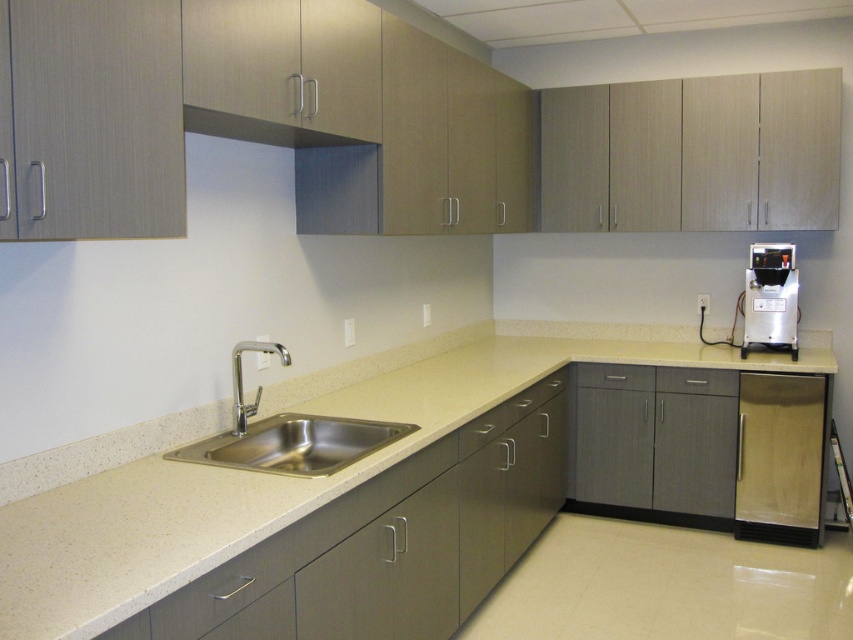
Question: Which object is positioned farthest from the beige laminate countertop at center?

Choices:
 (A) matte gray exhaust hood at upper center
 (B) satin silver appliance at right
 (C) wooden refrigerator at lower right

Answer: (C)

Question: Does gray matte drawer at lower right appear on the left side of gray matte drawer at center?

Choices:
 (A) no
 (B) yes

Answer: (A)

Question: Estimate the real-world distances between objects in this image. Which object is farther from the wooden refrigerator at lower right?

Choices:
 (A) stainless steel sink at lower left
 (B) beige laminate countertop at center
 (C) satin silver appliance at right
 (D) gray matte drawer at lower right

Answer: (A)

Question: Among these points, which one is farthest from the camera?

Choices:
 (A) (238, 369)
 (B) (260, 420)
 (C) (608, 387)

Answer: (C)

Question: Can you confirm if beige laminate countertop at center is positioned above polished chrome faucet at upper left?

Choices:
 (A) no
 (B) yes

Answer: (A)

Question: Does wooden refrigerator at lower right appear on the right side of matte gray drawer at center?

Choices:
 (A) no
 (B) yes

Answer: (B)